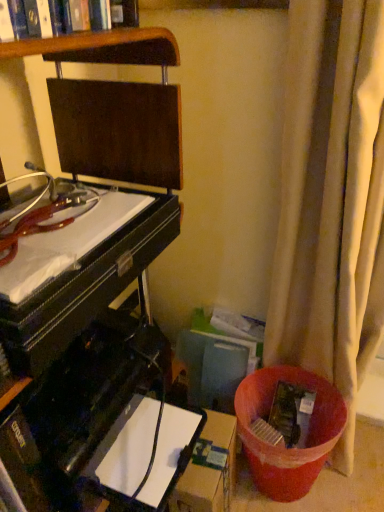
Question: Can you confirm if brown cardboard box at lower center is wider than beige fabric curtain at right?

Choices:
 (A) no
 (B) yes

Answer: (A)

Question: Is brown cardboard box at lower center at the right side of beige fabric curtain at right?

Choices:
 (A) yes
 (B) no

Answer: (B)

Question: Is brown cardboard box at lower center taller than beige fabric curtain at right?

Choices:
 (A) yes
 (B) no

Answer: (B)

Question: Does brown cardboard box at lower center come in front of beige fabric curtain at right?

Choices:
 (A) yes
 (B) no

Answer: (B)

Question: Is brown cardboard box at lower center behind beige fabric curtain at right?

Choices:
 (A) yes
 (B) no

Answer: (A)

Question: From a real-world perspective, is brown cardboard box at lower center located higher than beige fabric curtain at right?

Choices:
 (A) yes
 (B) no

Answer: (B)

Question: Is beige fabric curtain at right positioned behind black glossy computer desk at left?

Choices:
 (A) no
 (B) yes

Answer: (B)

Question: Is beige fabric curtain at right to the left of black glossy computer desk at left from the viewer's perspective?

Choices:
 (A) no
 (B) yes

Answer: (A)

Question: Is beige fabric curtain at right far away from black glossy computer desk at left?

Choices:
 (A) no
 (B) yes

Answer: (A)

Question: Is beige fabric curtain at right not inside black glossy computer desk at left?

Choices:
 (A) no
 (B) yes

Answer: (B)

Question: Considering the relative positions of beige fabric curtain at right and black glossy computer desk at left in the image provided, is beige fabric curtain at right in front of black glossy computer desk at left?

Choices:
 (A) no
 (B) yes

Answer: (A)

Question: Is beige fabric curtain at right shorter than black glossy computer desk at left?

Choices:
 (A) yes
 (B) no

Answer: (B)

Question: Does brown cardboard box at lower center come behind black glossy computer desk at left?

Choices:
 (A) yes
 (B) no

Answer: (A)